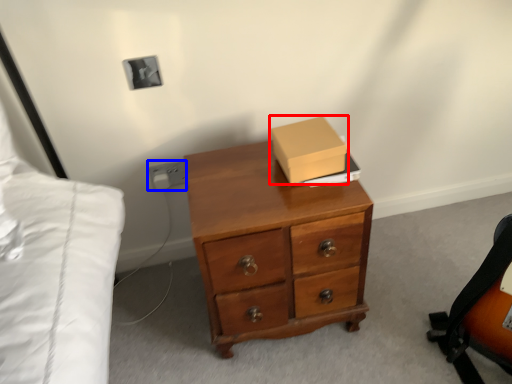
Question: Which object appears closest to the camera in this image, box (highlighted by a red box) or electric outlet (highlighted by a blue box)?

Choices:
 (A) box
 (B) electric outlet

Answer: (A)